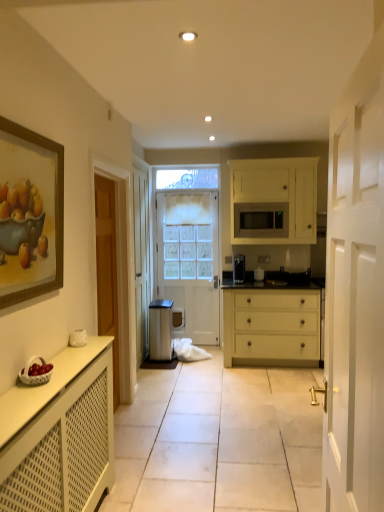
Question: Can you confirm if matte black coffee maker at center is taller than white matte radiator at lower left, the 1th cabinetry positioned from the left?

Choices:
 (A) yes
 (B) no

Answer: (B)

Question: Is matte black coffee maker at center to the right of white matte radiator at lower left, which is counted as the 1th cabinetry, starting from the bottom, from the viewer's perspective?

Choices:
 (A) no
 (B) yes

Answer: (B)

Question: Is matte black coffee maker at center further to camera compared to white matte radiator at lower left, the 2th cabinetry viewed from the right?

Choices:
 (A) no
 (B) yes

Answer: (B)

Question: From the image's perspective, is matte black coffee maker at center located beneath white matte radiator at lower left, the 2th cabinetry viewed from the right?

Choices:
 (A) yes
 (B) no

Answer: (B)

Question: From a real-world perspective, is matte black coffee maker at center over white matte radiator at lower left, the second cabinetry positioned from the back?

Choices:
 (A) yes
 (B) no

Answer: (A)

Question: In terms of size, does matte black microwave at upper right appear bigger or smaller than white glossy radiator at lower left?

Choices:
 (A) big
 (B) small

Answer: (B)

Question: Do you think matte black microwave at upper right is within white glossy radiator at lower left, or outside of it?

Choices:
 (A) inside
 (B) outside

Answer: (B)

Question: Is point (246, 215) closer or farther from the camera than point (140, 374)?

Choices:
 (A) closer
 (B) farther

Answer: (B)

Question: Relative to white glossy radiator at lower left, is matte black microwave at upper right in front or behind?

Choices:
 (A) front
 (B) behind

Answer: (B)

Question: Considering the positions of point (259, 267) and point (8, 183), is point (259, 267) closer or farther from the camera than point (8, 183)?

Choices:
 (A) farther
 (B) closer

Answer: (A)

Question: In the image, is matte black coffee maker at center positioned in front of or behind gold-framed painting at upper left?

Choices:
 (A) front
 (B) behind

Answer: (B)

Question: Visually, is matte black coffee maker at center positioned to the left or to the right of gold-framed painting at upper left?

Choices:
 (A) left
 (B) right

Answer: (B)

Question: From a real-world perspective, is matte black coffee maker at center positioned above or below gold-framed painting at upper left?

Choices:
 (A) below
 (B) above

Answer: (A)

Question: Is black glossy sink at center inside the boundaries of metallic trash bin at center, or outside?

Choices:
 (A) outside
 (B) inside

Answer: (A)

Question: In terms of height, does black glossy sink at center look taller or shorter compared to metallic trash bin at center?

Choices:
 (A) tall
 (B) short

Answer: (B)